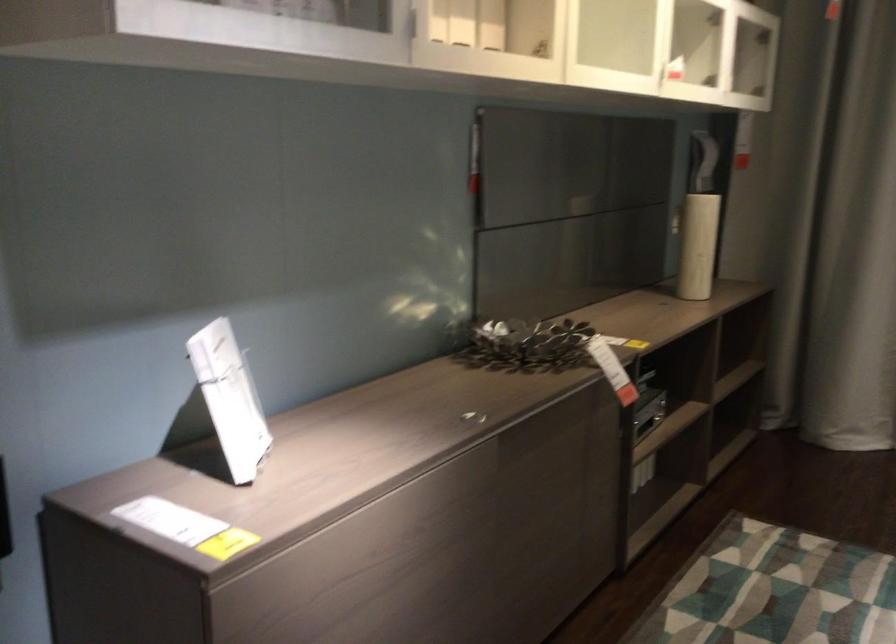
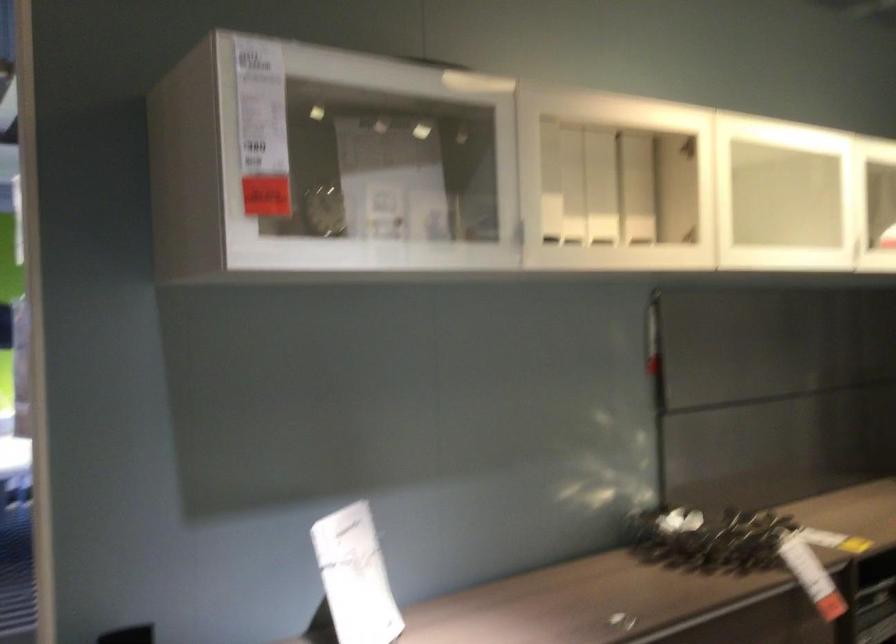
In the second image, find the point that corresponds to pixel 238 393 in the first image.

(355, 576)